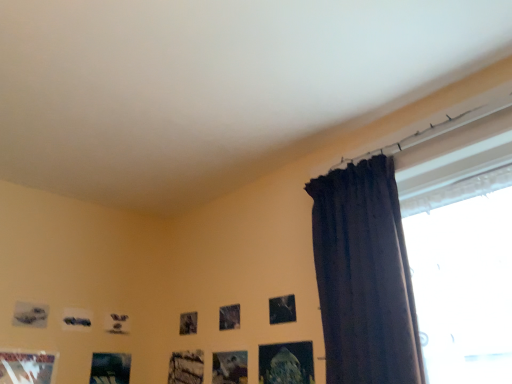
Question: Can you confirm if matte gray picture frame at lower left, arranged as the 7th picture frame when viewed from the right, is bigger than matte black picture frame at lower left, arranged as the 3th picture frame when viewed from the left?

Choices:
 (A) no
 (B) yes

Answer: (B)

Question: Can you confirm if matte gray picture frame at lower left, arranged as the 7th picture frame when viewed from the right, is taller than matte black picture frame at lower left, arranged as the 3th picture frame when viewed from the left?

Choices:
 (A) yes
 (B) no

Answer: (A)

Question: From the image's perspective, would you say matte gray picture frame at lower left, the first picture frame in the left-to-right sequence, is positioned over matte black picture frame at lower left, arranged as the 3th picture frame when viewed from the left?

Choices:
 (A) yes
 (B) no

Answer: (A)

Question: Does matte gray picture frame at lower left, arranged as the 7th picture frame when viewed from the right, appear on the left side of matte black picture frame at lower left, arranged as the 3th picture frame when viewed from the left?

Choices:
 (A) yes
 (B) no

Answer: (A)

Question: Can you confirm if matte gray picture frame at lower left, the first picture frame in the left-to-right sequence, is smaller than matte black picture frame at lower left, arranged as the 3th picture frame when viewed from the left?

Choices:
 (A) no
 (B) yes

Answer: (A)

Question: Considering the relative sizes of matte gray picture frame at lower left, arranged as the 7th picture frame when viewed from the right, and matte black picture frame at lower left, which is the fifth picture frame from right to left, in the image provided, is matte gray picture frame at lower left, arranged as the 7th picture frame when viewed from the right, thinner than matte black picture frame at lower left, which is the fifth picture frame from right to left,?

Choices:
 (A) no
 (B) yes

Answer: (A)

Question: Is metallic silver picture frame at lower left, the 6th picture frame in the right-to-left sequence, to the right of metallic silver picture frame at upper center, arranged as the sixth picture frame when viewed from the left, from the viewer's perspective?

Choices:
 (A) yes
 (B) no

Answer: (B)

Question: From the image's perspective, is metallic silver picture frame at lower left, the 2th picture frame in the left-to-right sequence, under metallic silver picture frame at upper center, which appears as the 2th picture frame when viewed from the right?

Choices:
 (A) yes
 (B) no

Answer: (A)

Question: Would you say metallic silver picture frame at lower left, the 6th picture frame in the right-to-left sequence, contains metallic silver picture frame at upper center, arranged as the sixth picture frame when viewed from the left?

Choices:
 (A) no
 (B) yes

Answer: (A)

Question: Can you confirm if metallic silver picture frame at lower left, the 2th picture frame in the left-to-right sequence, is positioned to the left of metallic silver picture frame at upper center, arranged as the sixth picture frame when viewed from the left?

Choices:
 (A) no
 (B) yes

Answer: (B)

Question: From the image's perspective, is metallic silver picture frame at lower left, the 2th picture frame in the left-to-right sequence, located above metallic silver picture frame at upper center, which appears as the 2th picture frame when viewed from the right?

Choices:
 (A) no
 (B) yes

Answer: (A)

Question: Can you confirm if metallic silver picture frame at lower left, the 2th picture frame in the left-to-right sequence, is shorter than metallic silver picture frame at upper center, which appears as the 2th picture frame when viewed from the right?

Choices:
 (A) no
 (B) yes

Answer: (A)

Question: From the image's perspective, is matte gray picture frame at lower left, arranged as the 7th picture frame when viewed from the right, located beneath metallic silver picture frame at upper center, which appears as the 2th picture frame when viewed from the right?

Choices:
 (A) no
 (B) yes

Answer: (B)